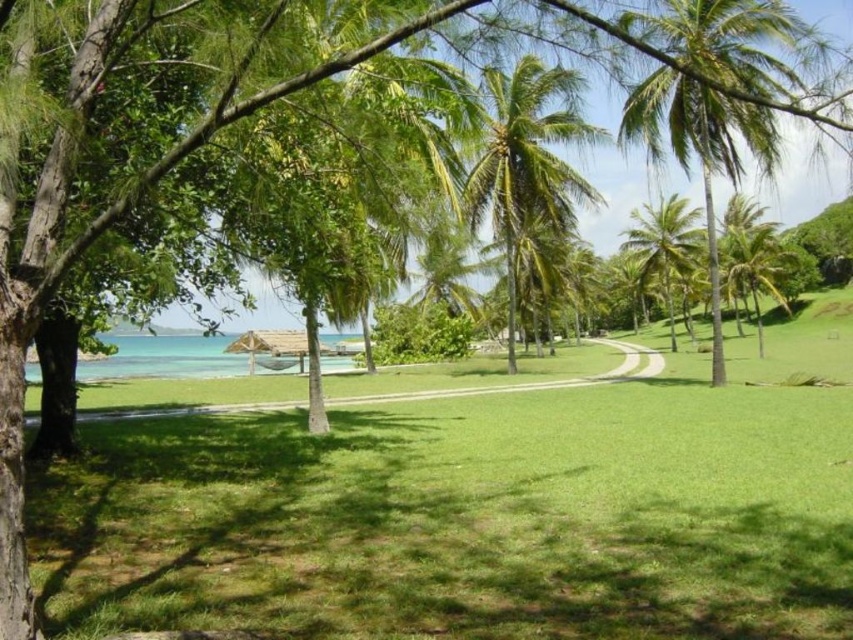
Question: Observing the image, what is the correct spatial positioning of green leafy palm tree at center in reference to green leafy palm tree at center-right?

Choices:
 (A) left
 (B) right

Answer: (A)

Question: Is green leafy palm tree at right positioned before green leafy palm tree at center-right?

Choices:
 (A) no
 (B) yes

Answer: (B)

Question: Which of these objects is positioned farthest from the green leafy palm tree at center?

Choices:
 (A) green leafy palm tree at upper right
 (B) green leafy palm tree at right
 (C) green leafy palm tree at center-right
 (D) clear blue water at lower left

Answer: (D)

Question: Does green leafy palm tree at upper right come in front of green leafy palm tree at center-right?

Choices:
 (A) no
 (B) yes

Answer: (B)

Question: Considering the real-world distances, which object is closest to the green leafy palm tree at center?

Choices:
 (A) green leafy palm tree at upper right
 (B) green leafy palm tree at center-right
 (C) green leafy palm tree at right

Answer: (A)

Question: Which point is closer to the camera?

Choices:
 (A) (184, 369)
 (B) (535, 156)
 (C) (746, 253)
 (D) (637, 113)

Answer: (D)